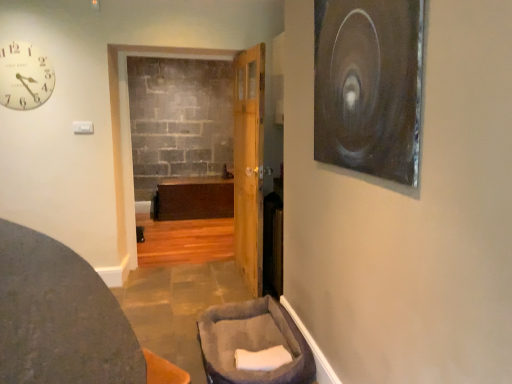
Question: Is metallic silver circular object at upper right shorter than gray plush pet bed at lower center, positioned as the 2th furniture in left-to-right order?

Choices:
 (A) yes
 (B) no

Answer: (B)

Question: Is metallic silver circular object at upper right behind gray plush pet bed at lower center, positioned as the 2th furniture in left-to-right order?

Choices:
 (A) no
 (B) yes

Answer: (A)

Question: Can you confirm if metallic silver circular object at upper right is smaller than gray plush pet bed at lower center, arranged as the first furniture when viewed from the right?

Choices:
 (A) no
 (B) yes

Answer: (B)

Question: Is metallic silver circular object at upper right positioned beyond the bounds of gray plush pet bed at lower center, arranged as the first furniture when viewed from the right?

Choices:
 (A) no
 (B) yes

Answer: (B)

Question: Can you confirm if metallic silver circular object at upper right is thinner than gray plush pet bed at lower center, positioned as the 2th furniture in left-to-right order?

Choices:
 (A) yes
 (B) no

Answer: (A)

Question: Considering their positions, is metallic silver circular object at upper right located in front of or behind dark gray fabric ottoman at lower left, which is the second furniture in right-to-left order?

Choices:
 (A) behind
 (B) front

Answer: (A)

Question: Considering the positions of metallic silver circular object at upper right and dark gray fabric ottoman at lower left, the first furniture positioned from the left, in the image, is metallic silver circular object at upper right taller or shorter than dark gray fabric ottoman at lower left, the first furniture positioned from the left,?

Choices:
 (A) short
 (B) tall

Answer: (A)

Question: Considering the positions of point (372, 104) and point (12, 296), is point (372, 104) closer or farther from the camera than point (12, 296)?

Choices:
 (A) closer
 (B) farther

Answer: (B)

Question: From the image's perspective, is metallic silver circular object at upper right located above or below dark gray fabric ottoman at lower left, the first furniture positioned from the left?

Choices:
 (A) below
 (B) above

Answer: (B)

Question: Considering the positions of wooden door at center and matte white clock at upper left in the image, is wooden door at center wider or thinner than matte white clock at upper left?

Choices:
 (A) thin
 (B) wide

Answer: (B)

Question: Is wooden door at center taller or shorter than matte white clock at upper left?

Choices:
 (A) tall
 (B) short

Answer: (A)

Question: From a real-world perspective, is wooden door at center positioned above or below matte white clock at upper left?

Choices:
 (A) below
 (B) above

Answer: (A)

Question: Is wooden door at center inside the boundaries of matte white clock at upper left, or outside?

Choices:
 (A) inside
 (B) outside

Answer: (B)

Question: From the image's perspective, is matte white clock at upper left located above or below dark gray fabric ottoman at lower left, which is the second furniture in right-to-left order?

Choices:
 (A) below
 (B) above

Answer: (B)

Question: From a real-world perspective, is matte white clock at upper left physically located above or below dark gray fabric ottoman at lower left, which is the second furniture in right-to-left order?

Choices:
 (A) below
 (B) above

Answer: (B)